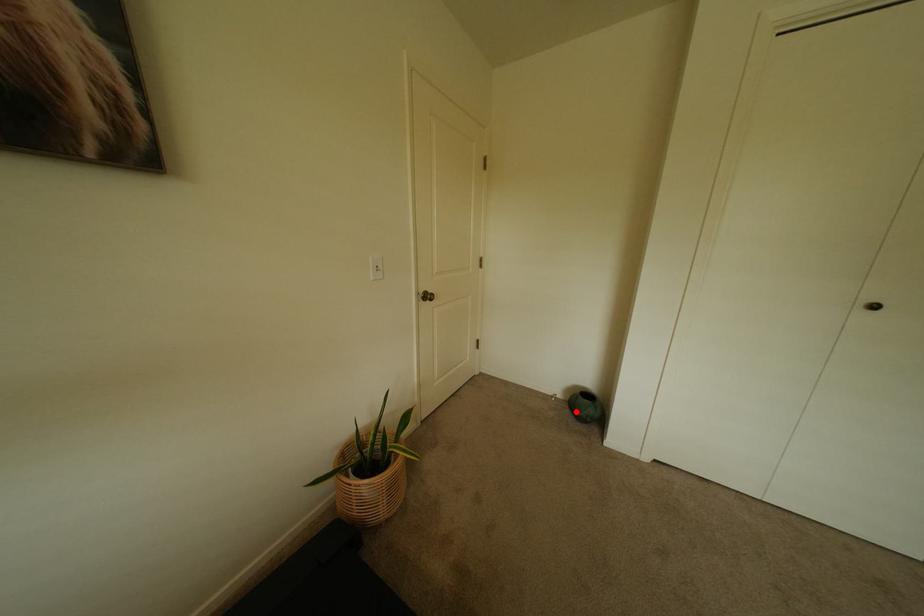
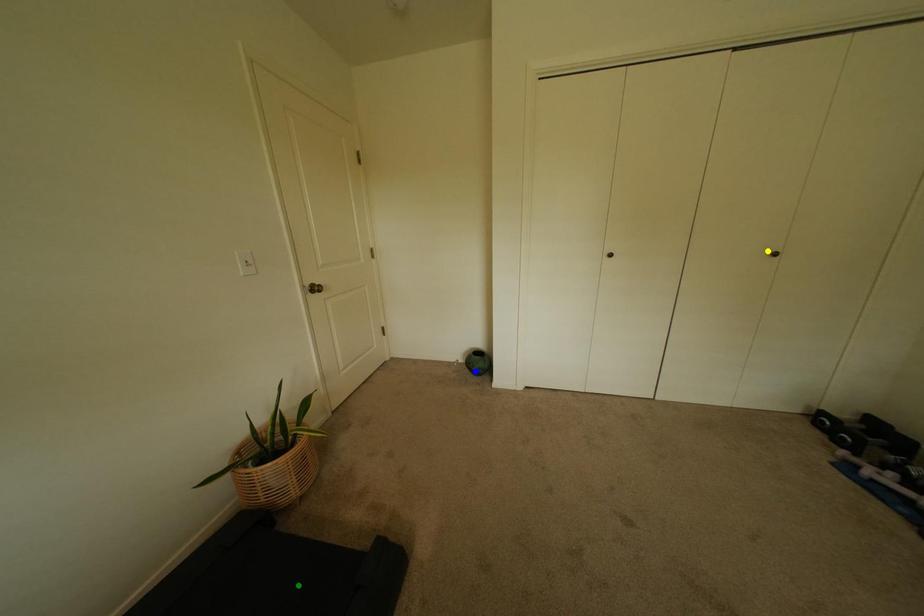
Question: I am providing you with two images of the same scene from different viewpoints. A red point is marked on the first image. You are given multiple points on the second image. Which point in image 2 is actually the same real-world point as the red point in image 1?

Choices:
 (A) blue point
 (B) yellow point
 (C) green point

Answer: (A)